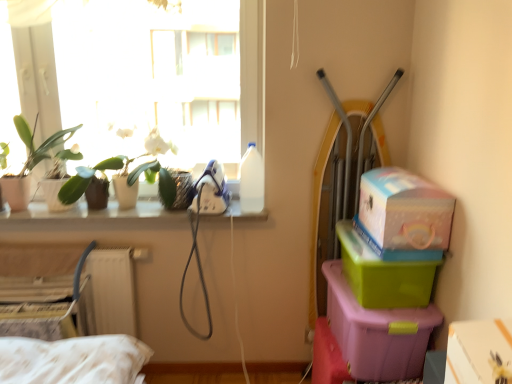
Question: In the image, is white cardboard box at lower right, the 1th box in the right-to-left sequence, on the left side or the right side of white matte orchid at upper left, the 1th plant from the right?

Choices:
 (A) right
 (B) left

Answer: (A)

Question: From a real-world perspective, relative to white matte orchid at upper left, which is the 2th plant in left-to-right order, is white cardboard box at lower right, which ranks as the fifth box in left-to-right order, vertically above or below?

Choices:
 (A) below
 (B) above

Answer: (A)

Question: Which of these objects is positioned farthest from the white glossy window sill at upper left?

Choices:
 (A) white cardboard box at lower left, acting as the first box starting from the left
 (B) green plastic box at lower right, the 2th box from the left
 (C) white matte orchid at upper left, the 1th plant from the right
 (D) matte white pot at left
 (E) green plastic box at right, placed as the 4th box when sorted from left to right

Answer: (B)

Question: Estimate the real-world distances between objects in this image. Which object is farther from the matte white pot at left?

Choices:
 (A) green plastic box at lower right, arranged as the 4th box when viewed from the right
 (B) white cardboard box at lower left, the 5th box in the right-to-left sequence
 (C) green plastic box at right, the second box viewed from the right
 (D) white matte orchid at upper left, which is the 2th plant in left-to-right order
 (E) transparent glass window at upper left

Answer: (A)